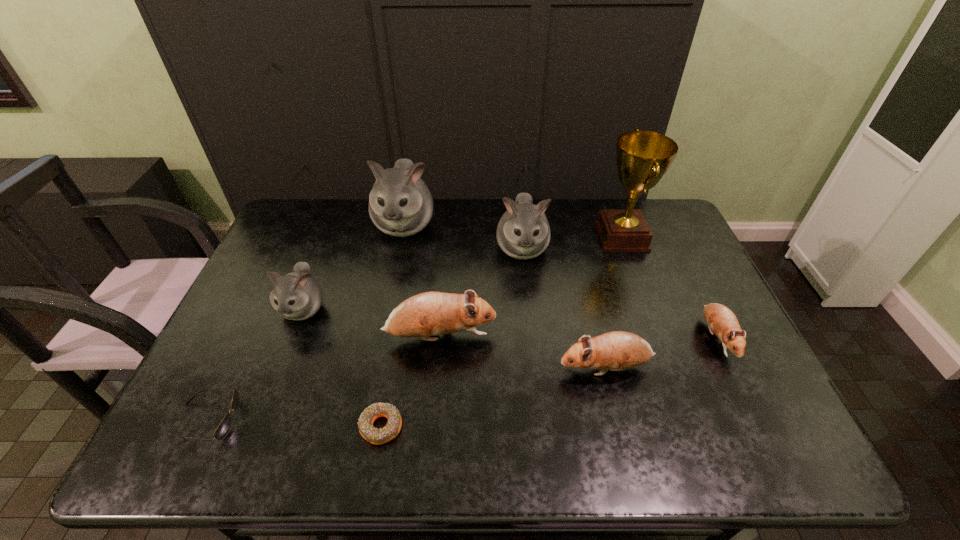
The height and width of the screenshot is (540, 960). What are the coordinates of `sunglasses present at the near edge` in the screenshot? It's located at (223, 429).

Locate an element on the screen. This screenshot has height=540, width=960. doughnut positioned at the near edge is located at coordinates point(376,436).

At what (x,y) coordinates should I click in order to perform the action: click on hamster situated at the left edge. Please return your answer as a coordinate pair (x, y). The width and height of the screenshot is (960, 540). Looking at the image, I should click on (296, 296).

This screenshot has height=540, width=960. What are the coordinates of `sunglasses that is positioned at the left edge` in the screenshot? It's located at (223, 429).

You are a GUI agent. You are given a task and a screenshot of the screen. Output one action in this format:
    pyautogui.click(x=<x>, y=<y>)
    Task: Click on the award located at the right edge
    This screenshot has height=540, width=960.
    Given the screenshot: What is the action you would take?
    pyautogui.click(x=643, y=157)

You are a GUI agent. You are given a task and a screenshot of the screen. Output one action in this format:
    pyautogui.click(x=<x>, y=<y>)
    Task: Click on the hamster that is at the right edge
    
    Given the screenshot: What is the action you would take?
    pyautogui.click(x=721, y=320)

The height and width of the screenshot is (540, 960). In order to click on object located in the near left corner section of the desktop in this screenshot , I will do `click(223, 429)`.

This screenshot has width=960, height=540. Identify the location of object that is at the far right corner. (643, 157).

I want to click on free location at the far edge, so click(432, 233).

Locate an element on the screen. This screenshot has height=540, width=960. vacant space at the left edge is located at coordinates (280, 273).